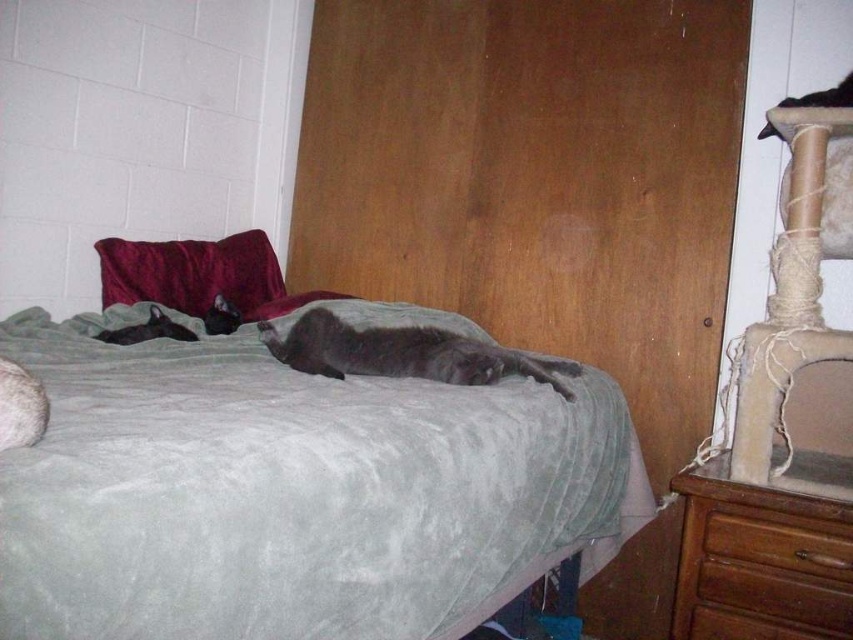
Question: From the image, what is the correct spatial relationship of velvet-like burgundy pillow at upper left in relation to black fur cat at upper left?

Choices:
 (A) left
 (B) right

Answer: (A)

Question: Which point is closer to the camera?

Choices:
 (A) brown wood drawer at lower right
 (B) velvet-like burgundy pillow at upper left
 (C) brown wood dresser at lower right
 (D) dark gray fur cat at left

Answer: (C)

Question: Does gray soft fur cat at center appear on the right side of dark gray fur cat at left?

Choices:
 (A) yes
 (B) no

Answer: (A)

Question: Which of these objects is positioned farthest from the dark gray fur cat at left?

Choices:
 (A) brown wood drawer at lower right
 (B) black fur cat at upper left
 (C) black fur cat at upper right
 (D) gray soft fur cat at center

Answer: (C)

Question: Among these objects, which one is nearest to the camera?

Choices:
 (A) brown wood dresser at lower right
 (B) gray velvety blanket at center
 (C) velvet-like burgundy pillow at upper left
 (D) gray soft fur cat at center

Answer: (B)

Question: Is gray velvety blanket at center bigger than dark gray fur cat at left?

Choices:
 (A) no
 (B) yes

Answer: (B)